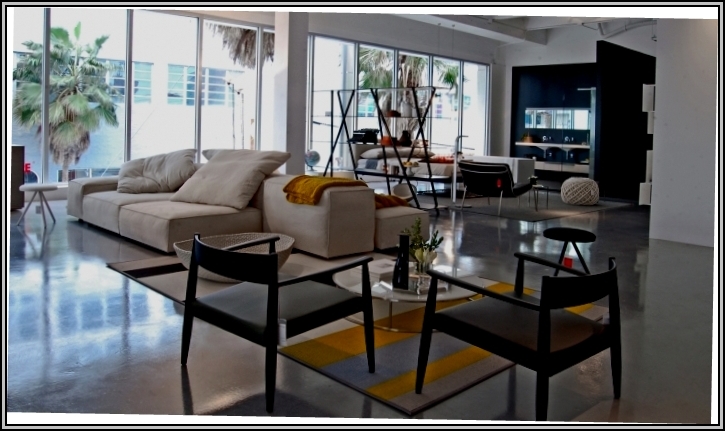
Where is `windows`? The image size is (725, 431). windows is located at coordinates (29, 98), (75, 96), (141, 99), (228, 78), (326, 74), (373, 80), (418, 68), (451, 78), (481, 78).